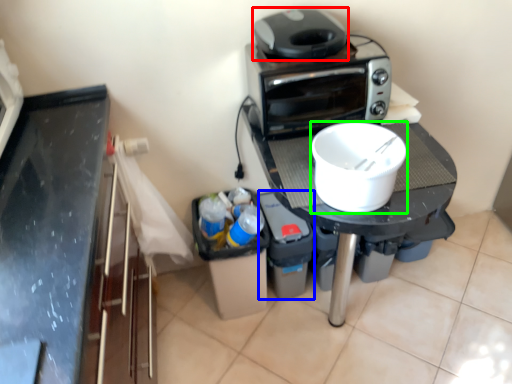
Question: Which object is positioned farthest from home appliance (highlighted by a red box)? Select from appliance (highlighted by a blue box) and kitchen appliance (highlighted by a green box).

Choices:
 (A) appliance
 (B) kitchen appliance

Answer: (A)